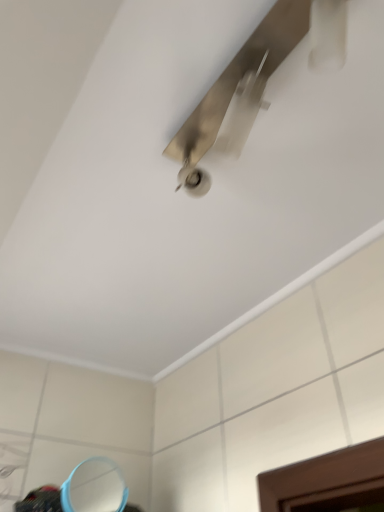
What is the approximate height of metallic silver ceiling fan at upper center?

It is 15.05 centimeters.

The width and height of the screenshot is (384, 512). Describe the element at coordinates (257, 79) in the screenshot. I see `metallic silver ceiling fan at upper center` at that location.

Image resolution: width=384 pixels, height=512 pixels. What are the coordinates of `metallic silver ceiling fan at upper center` in the screenshot? It's located at (257, 79).

This screenshot has height=512, width=384. I want to click on blue plastic mirror at lower left, so click(x=94, y=487).

Image resolution: width=384 pixels, height=512 pixels. What do you see at coordinates (94, 487) in the screenshot? I see `blue plastic mirror at lower left` at bounding box center [94, 487].

In order to face blue plastic mirror at lower left, should I rotate leftwards or rightwards?

Turn left by 13.222 degrees to look at blue plastic mirror at lower left.

In order to click on metallic silver ceiling fan at upper center in this screenshot , I will do `click(257, 79)`.

In the scene shown: Between metallic silver ceiling fan at upper center and blue plastic mirror at lower left, which one appears on the right side from the viewer's perspective?

From the viewer's perspective, metallic silver ceiling fan at upper center appears more on the right side.

Is metallic silver ceiling fan at upper center positioned behind blue plastic mirror at lower left?

No, it is not.

Which point is more distant from viewer, (260,102) or (93,495)?

The point (93,495) is more distant.

From the image's perspective, is metallic silver ceiling fan at upper center above or below blue plastic mirror at lower left?

From the image's perspective, metallic silver ceiling fan at upper center appears above blue plastic mirror at lower left.

From a real-world perspective, between metallic silver ceiling fan at upper center and blue plastic mirror at lower left, who is vertically higher?

metallic silver ceiling fan at upper center is physically above.

Which of these two, metallic silver ceiling fan at upper center or blue plastic mirror at lower left, is wider?

With larger width is metallic silver ceiling fan at upper center.

In terms of height, does metallic silver ceiling fan at upper center look taller or shorter compared to blue plastic mirror at lower left?

Clearly, metallic silver ceiling fan at upper center is shorter compared to blue plastic mirror at lower left.

Is metallic silver ceiling fan at upper center smaller than blue plastic mirror at lower left?

Incorrect, metallic silver ceiling fan at upper center is not smaller in size than blue plastic mirror at lower left.

Is metallic silver ceiling fan at upper center positioned beyond the bounds of blue plastic mirror at lower left?

metallic silver ceiling fan at upper center lies outside blue plastic mirror at lower left's area.

Is metallic silver ceiling fan at upper center positioned far away from blue plastic mirror at lower left?

Indeed, metallic silver ceiling fan at upper center is not near blue plastic mirror at lower left.

In the scene shown: Is metallic silver ceiling fan at upper center turned away from blue plastic mirror at lower left?

metallic silver ceiling fan at upper center is not turned away from blue plastic mirror at lower left.

The width and height of the screenshot is (384, 512). I want to click on mirror below the metallic silver ceiling fan at upper center (from the image's perspective), so click(x=94, y=487).

Between blue plastic mirror at lower left and metallic silver ceiling fan at upper center, which one appears on the right side from the viewer's perspective?

From the viewer's perspective, metallic silver ceiling fan at upper center appears more on the right side.

Is blue plastic mirror at lower left in front of or behind metallic silver ceiling fan at upper center in the image?

blue plastic mirror at lower left is positioned farther from the viewer than metallic silver ceiling fan at upper center.

Considering the positions of points (87, 488) and (223, 72), is point (87, 488) closer to camera compared to point (223, 72)?

No.

From the image's perspective, between blue plastic mirror at lower left and metallic silver ceiling fan at upper center, who is located below?

From the image's view, blue plastic mirror at lower left is below.

From a real-world perspective, who is located higher, blue plastic mirror at lower left or metallic silver ceiling fan at upper center?

In real-world perspective, metallic silver ceiling fan at upper center is above.

Is blue plastic mirror at lower left wider than metallic silver ceiling fan at upper center?

In fact, blue plastic mirror at lower left might be narrower than metallic silver ceiling fan at upper center.

Considering the sizes of objects blue plastic mirror at lower left and metallic silver ceiling fan at upper center in the image provided, who is shorter, blue plastic mirror at lower left or metallic silver ceiling fan at upper center?

With less height is metallic silver ceiling fan at upper center.

In terms of size, does blue plastic mirror at lower left appear bigger or smaller than metallic silver ceiling fan at upper center?

blue plastic mirror at lower left is smaller than metallic silver ceiling fan at upper center.

Choose the correct answer: Is blue plastic mirror at lower left inside metallic silver ceiling fan at upper center or outside it?

The correct answer is: outside.

Is the surface of blue plastic mirror at lower left in direct contact with metallic silver ceiling fan at upper center?

blue plastic mirror at lower left and metallic silver ceiling fan at upper center are not in contact.

Is blue plastic mirror at lower left facing towards metallic silver ceiling fan at upper center?

Yes, blue plastic mirror at lower left is oriented towards metallic silver ceiling fan at upper center.

How many degrees apart are the facing directions of blue plastic mirror at lower left and metallic silver ceiling fan at upper center?

91.4 degrees.

How much distance is there between blue plastic mirror at lower left and metallic silver ceiling fan at upper center?

1.61 meters.

You are a GUI agent. You are given a task and a screenshot of the screen. Output one action in this format:
    pyautogui.click(x=<x>, y=<y>)
    Task: Click on the ceiling fan lying above the blue plastic mirror at lower left (from the image's perspective)
    This screenshot has width=384, height=512.
    Given the screenshot: What is the action you would take?
    pyautogui.click(x=257, y=79)

Identify the location of mirror directly beneath the metallic silver ceiling fan at upper center (from a real-world perspective). (94, 487).

Find the location of a particular element. The height and width of the screenshot is (512, 384). ceiling fan on the right of blue plastic mirror at lower left is located at coordinates 257,79.